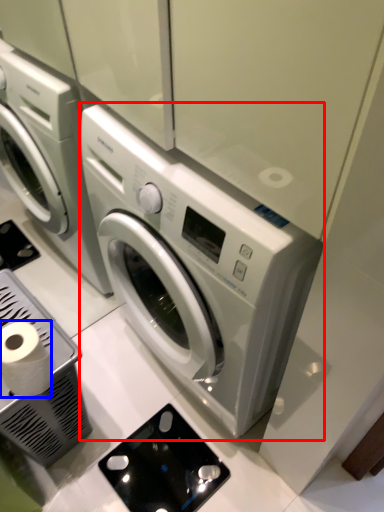
Question: Which object appears closest to the camera in this image, washing machine (highlighted by a red box) or toilet paper (highlighted by a blue box)?

Choices:
 (A) washing machine
 (B) toilet paper

Answer: (A)